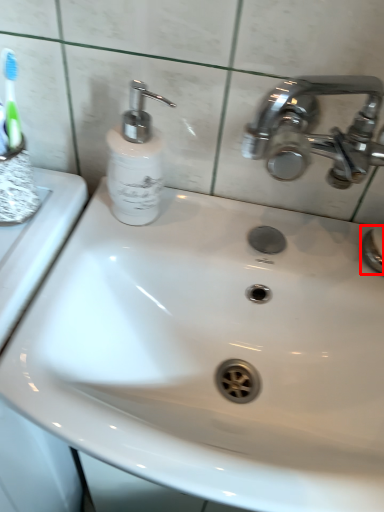
Question: From the image's perspective, what is the correct spatial positioning of plumbing fixture (annotated by the red box) in reference to soap dispenser?

Choices:
 (A) above
 (B) below

Answer: (B)